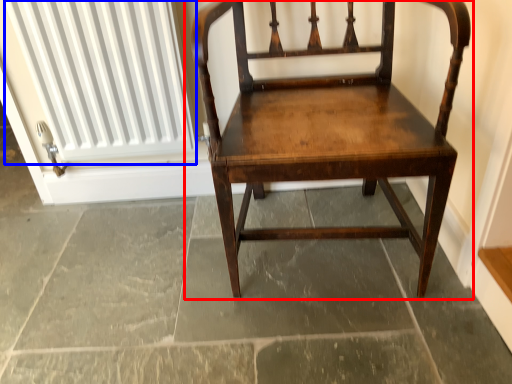
Question: Which object is closer to the camera taking this photo, chair (highlighted by a red box) or radiator (highlighted by a blue box)?

Choices:
 (A) chair
 (B) radiator

Answer: (A)